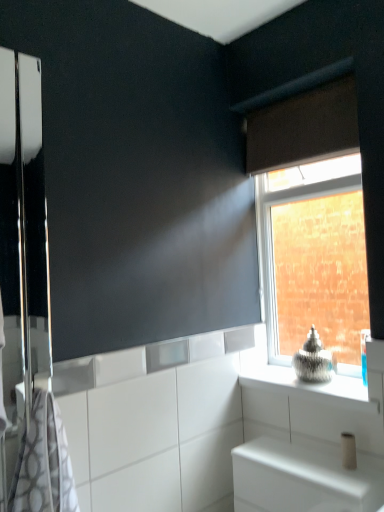
Question: Is gray-patterned towel at left situated inside white matte toilet paper at lower right or outside?

Choices:
 (A) inside
 (B) outside

Answer: (B)

Question: Considering the positions of gray-patterned towel at left and white matte toilet paper at lower right in the image, is gray-patterned towel at left wider or thinner than white matte toilet paper at lower right?

Choices:
 (A) wide
 (B) thin

Answer: (A)

Question: Based on their relative distances, which object is farther from the polished chrome screen door at left?

Choices:
 (A) clear glass window at upper right
 (B) white glossy cabinet at lower right
 (C) gray-patterned towel at left
 (D) metallic silver vase at upper right
 (E) white matte toilet paper at lower right

Answer: (E)

Question: Which object is positioned closest to the gray-patterned towel at left?

Choices:
 (A) metallic silver vase at upper right
 (B) white glossy cabinet at lower right
 (C) clear glass window at upper right
 (D) brown fabric curtain at upper right
 (E) white matte toilet paper at lower right

Answer: (B)